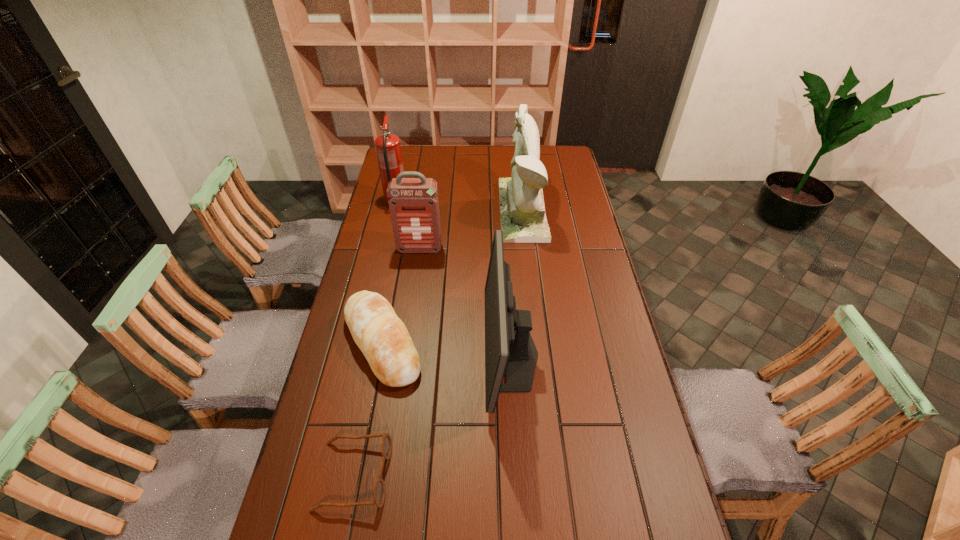
Where is `vacant space located 0.150m on the handle side the fire extinguisher`? The height and width of the screenshot is (540, 960). vacant space located 0.150m on the handle side the fire extinguisher is located at coordinates (403, 175).

Identify the location of free space located on the handle side the fire extinguisher. (400, 186).

Where is `vacant region located on the handle side the fire extinguisher`? vacant region located on the handle side the fire extinguisher is located at coordinates (405, 166).

Identify the location of free space located 0.150m on the front-facing side of the first-aid kit. (415, 282).

Find the location of a particular element. This screenshot has width=960, height=540. free region located on the screen side of the computer monitor is located at coordinates (446, 354).

You are a GUI agent. You are given a task and a screenshot of the screen. Output one action in this format:
    pyautogui.click(x=<x>, y=<y>)
    Task: Click on the free space located 0.060m on the screen side of the computer monitor
    The image size is (960, 540).
    Given the screenshot: What is the action you would take?
    pyautogui.click(x=466, y=354)

Image resolution: width=960 pixels, height=540 pixels. What are the coordinates of `blank area located 0.230m on the screen side of the computer monitor` in the screenshot? It's located at (411, 354).

The width and height of the screenshot is (960, 540). Identify the location of free location located on the front of the fifth tallest object. (368, 420).

I want to click on free region located on the front-facing side of the nearest object, so click(539, 474).

Find the location of `fire extinguisher present at the left edge`. fire extinguisher present at the left edge is located at coordinates (388, 149).